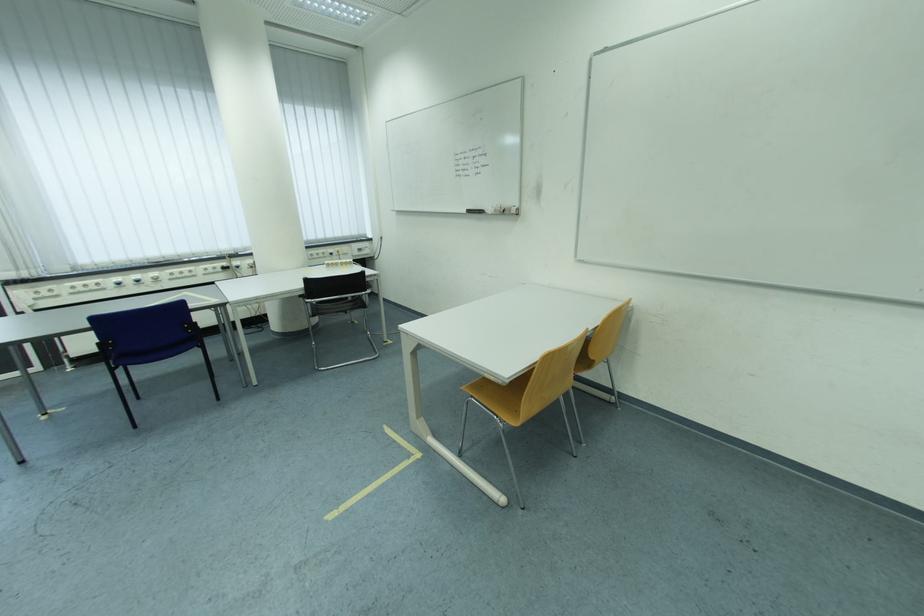
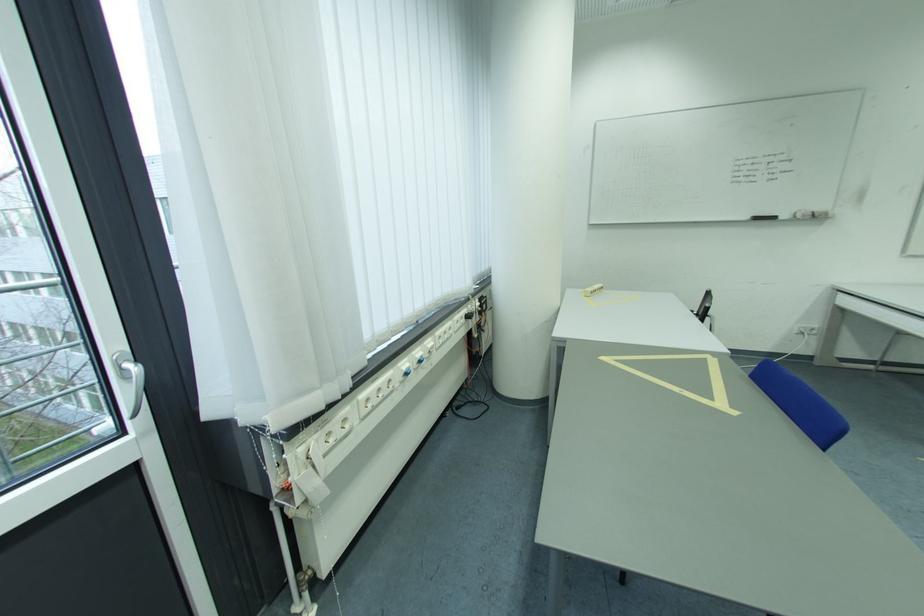
Which direction would the cameraman need to move to produce the second image?

The movement direction of the cameraman is left, forward.